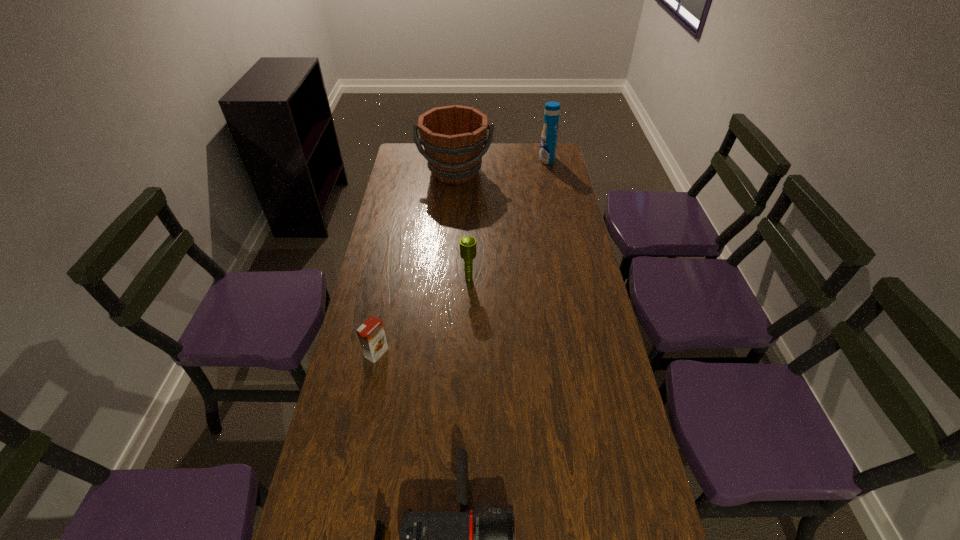
In the image, there is a desktop. Find the location of `free space at the right edge`. free space at the right edge is located at coordinates (568, 424).

The width and height of the screenshot is (960, 540). In the image, there is a desktop. What are the coordinates of `vacant area at the far left corner` in the screenshot? It's located at (396, 166).

Locate an element on the screen. This screenshot has width=960, height=540. empty location between the microphone and the orange juice is located at coordinates (422, 315).

At what (x,y) coordinates should I click in order to perform the action: click on vacant space that is in between the bucket and the orange juice. Please return your answer as a coordinate pair (x, y). The height and width of the screenshot is (540, 960). Looking at the image, I should click on (416, 262).

Image resolution: width=960 pixels, height=540 pixels. What are the coordinates of `empty location between the second nearest object and the bucket` in the screenshot? It's located at (416, 262).

I want to click on free space between the bucket and the third shortest object, so click(462, 225).

The width and height of the screenshot is (960, 540). I want to click on empty location between the bucket and the third shortest object, so click(462, 225).

You are a GUI agent. You are given a task and a screenshot of the screen. Output one action in this format:
    pyautogui.click(x=<x>, y=<y>)
    Task: Click on the vacant point located between the orange juice and the bucket
    
    Given the screenshot: What is the action you would take?
    pyautogui.click(x=416, y=262)

In order to click on free spot between the rightmost object and the third nearest object in this screenshot , I will do `click(508, 219)`.

Locate an element on the screen. object that is the second closest one to the bucket is located at coordinates (467, 243).